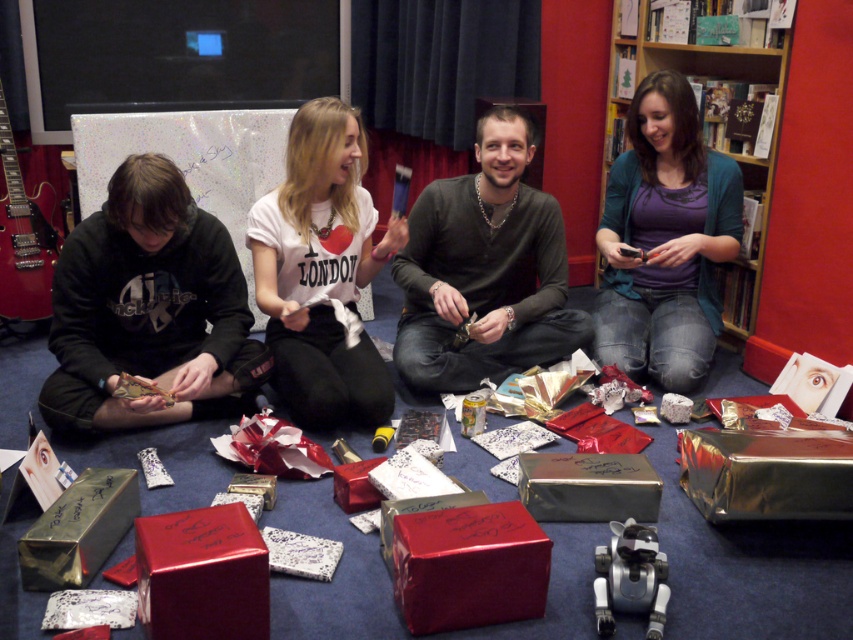
Which is in front, point (349, 403) or point (633, 476)?

Point (633, 476) is in front.

Does white cotton t-shirt at center appear under metallic silver box at center?

Incorrect, white cotton t-shirt at center is not positioned below metallic silver box at center.

You are a GUI agent. You are given a task and a screenshot of the screen. Output one action in this format:
    pyautogui.click(x=<x>, y=<y>)
    Task: Click on the white cotton t-shirt at center
    
    Given the screenshot: What is the action you would take?
    pyautogui.click(x=321, y=269)

Who is shorter, glossy red box at center or metallic silver gift box at lower left?

With less height is metallic silver gift box at lower left.

Looking at this image, is glossy red box at center below metallic silver gift box at lower left?

Correct, glossy red box at center is located below metallic silver gift box at lower left.

Is point (154, 563) less distant than point (57, 588)?

That is True.

Image resolution: width=853 pixels, height=640 pixels. Identify the location of glossy red box at center. (202, 573).

Is black matte hoodie at lower left taller than shiny red box at center?

Yes.

Does black matte hoodie at lower left have a greater width compared to shiny red box at center?

Indeed, black matte hoodie at lower left has a greater width compared to shiny red box at center.

Locate an element on the screen. The height and width of the screenshot is (640, 853). black matte hoodie at lower left is located at coordinates (149, 310).

Where is `black matte hoodie at lower left`? The image size is (853, 640). black matte hoodie at lower left is located at coordinates [149, 310].